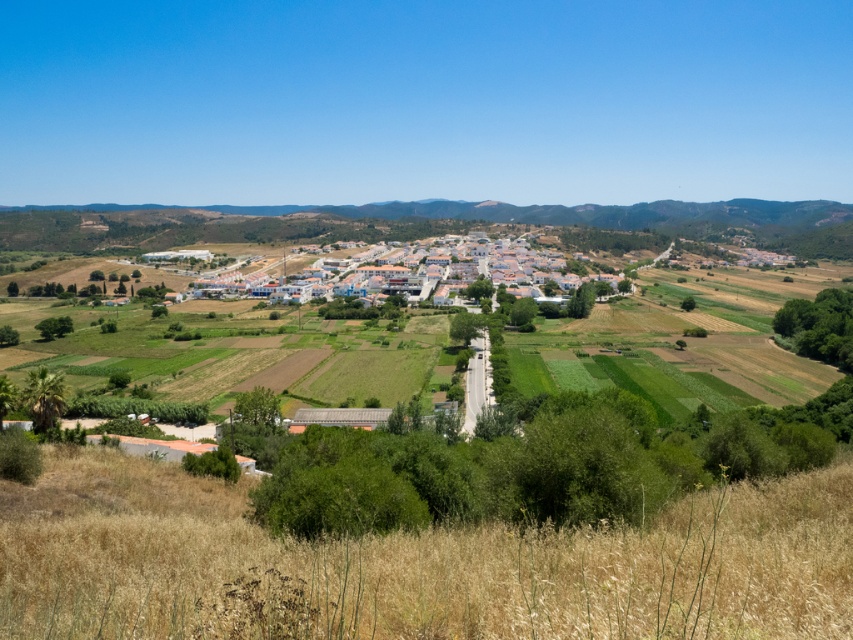
Does dry grass at lower center lie in front of white matte buildings at center?

Yes, it is.

Who is taller, dry grass at lower center or white matte buildings at center?

white matte buildings at center

What do you see at coordinates (415, 564) in the screenshot?
I see `dry grass at lower center` at bounding box center [415, 564].

Find the location of a particular element. dry grass at lower center is located at coordinates 415,564.